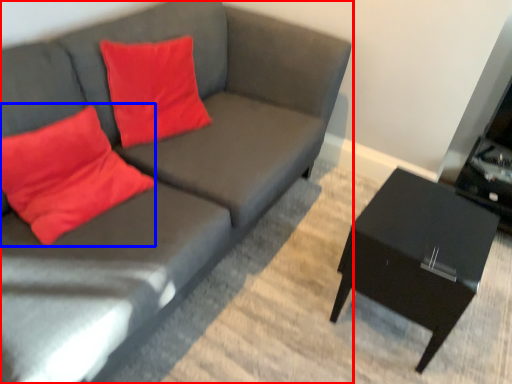
Question: Among these objects, which one is farthest to the camera, studio couch (highlighted by a red box) or throw pillow (highlighted by a blue box)?

Choices:
 (A) studio couch
 (B) throw pillow

Answer: (B)